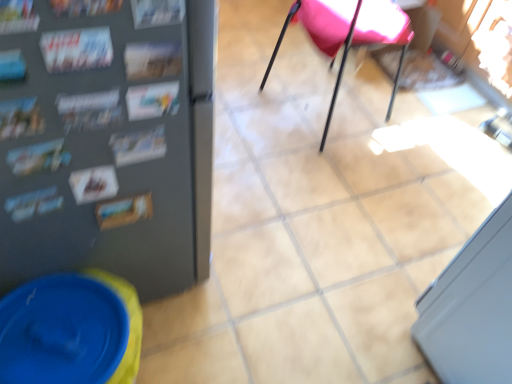
Question: Considering the relative positions of printed paper magazine at upper left, arranged as the second magazine when viewed from the left, and matte paper magazine at upper left, which is counted as the 3th magazine, starting from the left, in the image provided, is printed paper magazine at upper left, arranged as the second magazine when viewed from the left, to the left of matte paper magazine at upper left, which is counted as the 3th magazine, starting from the left, from the viewer's perspective?

Choices:
 (A) no
 (B) yes

Answer: (B)

Question: Is matte paper magazine at upper left, the 1th magazine viewed from the right, inside printed paper magazine at upper left, arranged as the second magazine when viewed from the left?

Choices:
 (A) yes
 (B) no

Answer: (B)

Question: Does printed paper magazine at upper left, which ranks as the second magazine in right-to-left order, come in front of matte paper magazine at upper left, which is counted as the 3th magazine, starting from the left?

Choices:
 (A) yes
 (B) no

Answer: (B)

Question: From the image's perspective, is printed paper magazine at upper left, which ranks as the second magazine in right-to-left order, located beneath matte paper magazine at upper left, the 1th magazine viewed from the right?

Choices:
 (A) no
 (B) yes

Answer: (B)

Question: Is printed paper magazine at upper left, arranged as the second magazine when viewed from the left, facing away from matte paper magazine at upper left, which is counted as the 3th magazine, starting from the left?

Choices:
 (A) yes
 (B) no

Answer: (B)

Question: Does printed paper magazine at upper left, arranged as the second magazine when viewed from the left, have a greater height compared to matte paper magazine at upper left, the 1th magazine viewed from the right?

Choices:
 (A) yes
 (B) no

Answer: (B)

Question: Is printed paper magazine at left, placed as the first magazine when sorted from left to right, inside pink fabric chair at center?

Choices:
 (A) no
 (B) yes

Answer: (A)

Question: Considering the relative positions of pink fabric chair at center and printed paper magazine at left, which ranks as the 3th magazine in right-to-left order, in the image provided, is pink fabric chair at center to the right of printed paper magazine at left, which ranks as the 3th magazine in right-to-left order, from the viewer's perspective?

Choices:
 (A) yes
 (B) no

Answer: (A)

Question: Is pink fabric chair at center bigger than printed paper magazine at left, which ranks as the 3th magazine in right-to-left order?

Choices:
 (A) yes
 (B) no

Answer: (A)

Question: Does pink fabric chair at center lie in front of printed paper magazine at left, placed as the first magazine when sorted from left to right?

Choices:
 (A) yes
 (B) no

Answer: (B)

Question: From a real-world perspective, is pink fabric chair at center below printed paper magazine at left, placed as the first magazine when sorted from left to right?

Choices:
 (A) no
 (B) yes

Answer: (B)

Question: Considering the relative sizes of pink fabric chair at center and printed paper magazine at left, which ranks as the 3th magazine in right-to-left order, in the image provided, is pink fabric chair at center taller than printed paper magazine at left, which ranks as the 3th magazine in right-to-left order,?

Choices:
 (A) no
 (B) yes

Answer: (B)

Question: From a real-world perspective, is matte paper magazine at upper left, which is counted as the 3th magazine, starting from the left, under pink fabric chair at center?

Choices:
 (A) no
 (B) yes

Answer: (A)